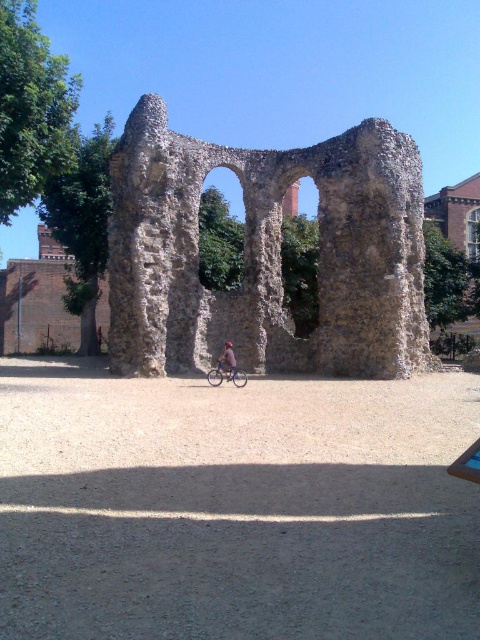
You are a tour guide explaining the historical ruins to visitors. You point out the shiny metallic bicycle at center and the blue fabric bicycle at center. Which bicycle is positioned lower in the image?

The shiny metallic bicycle at center is positioned lower than the blue fabric bicycle at center.

In the scene shown: You are standing at the point marked by the coordinates (227, 374) in the image. What object are you directly facing?

The point marked by the coordinates (227, 374) indicates the shiny metallic bicycle at center, so you are directly facing the shiny metallic bicycle at center.

You are standing at the point labeled as point (266,253) in the image. Looking around, you see the historical stone structure with two large arches at the center. Which direction should you walk to reach the gravelly ground in front of the ruins?

Since the point (266,253) is on the stone arches at center, you should walk forward towards the gravelly ground in front of the ruins to reach it.